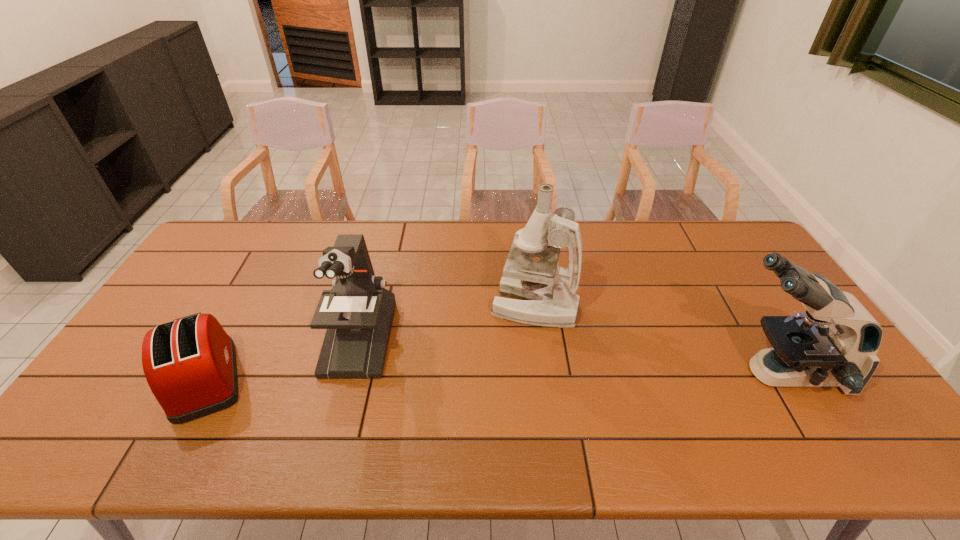
Locate an element on the screen. free spot at the near right corner of the desktop is located at coordinates (874, 454).

You are a GUI agent. You are given a task and a screenshot of the screen. Output one action in this format:
    pyautogui.click(x=<x>, y=<y>)
    Task: Click on the free spot between the leftmost microscope and the second microscope from right to left
    The width and height of the screenshot is (960, 540).
    Given the screenshot: What is the action you would take?
    (446, 323)

Identify the location of blank region between the toaster and the leftmost microscope. The height and width of the screenshot is (540, 960). (282, 359).

The image size is (960, 540). Identify the location of empty space between the second object from left to right and the second microscope from left to right. (446, 323).

Find the location of a particular element. vacant area between the third object from right to left and the second microscope from left to right is located at coordinates (446, 323).

You are a GUI agent. You are given a task and a screenshot of the screen. Output one action in this format:
    pyautogui.click(x=<x>, y=<y>)
    Task: Click on the vacant region between the second object from right to left and the second object from left to right
    
    Given the screenshot: What is the action you would take?
    pyautogui.click(x=446, y=323)

Where is `free spot between the leftmost microscope and the leftmost object`? The image size is (960, 540). free spot between the leftmost microscope and the leftmost object is located at coordinates (282, 359).

Choose which object is the third nearest neighbor to the shortest object. Please provide its 2D coordinates. Your answer should be formatted as a tuple, i.e. [(x, y)], where the tuple contains the x and y coordinates of a point satisfying the conditions above.

[(835, 343)]

Locate which object is the second closest to the rightmost object. Please provide its 2D coordinates. Your answer should be formatted as a tuple, i.e. [(x, y)], where the tuple contains the x and y coordinates of a point satisfying the conditions above.

[(358, 312)]

Identify the location of microscope that is the closest to the toaster. (358, 312).